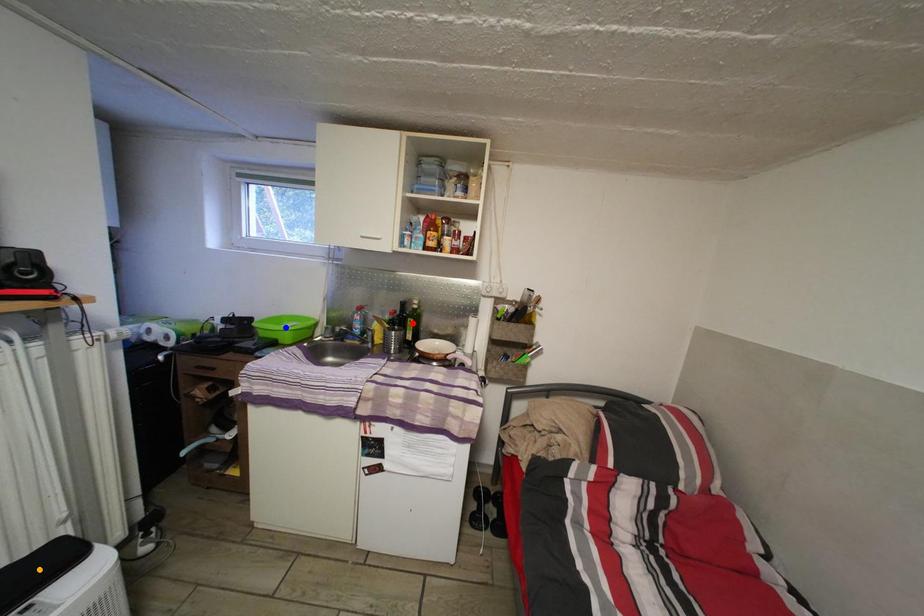
Order these from farthest to nearest:
red point, orange point, blue point

red point → blue point → orange point